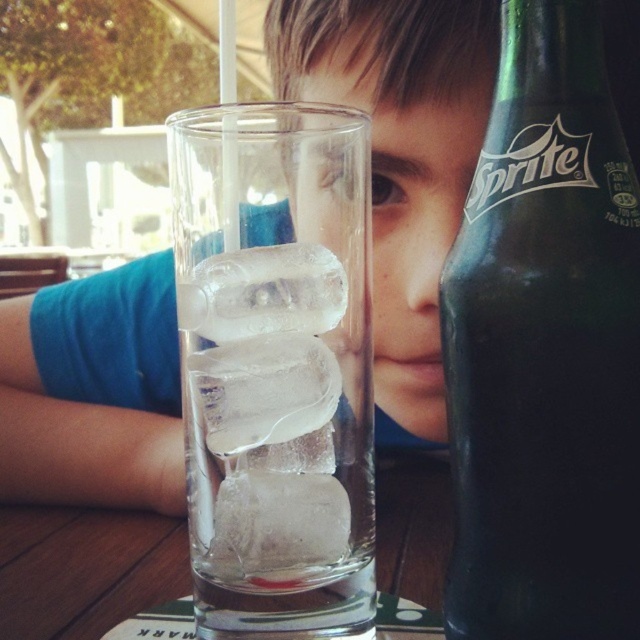
You are trying to reach for the transparent glass ice at center but there is a green glass bottle at right in the way. Which object is closer to your right hand?

The green glass bottle at right is to the right of transparent glass ice at center, so the green glass bottle at right is closer to your right hand.

You are a bartender preparing a drink. You have a green glass bottle at right and a transparent glass ice at center. Which object is bigger in size?

The green glass bottle at right is larger in size compared to the transparent glass ice at center according to the description.